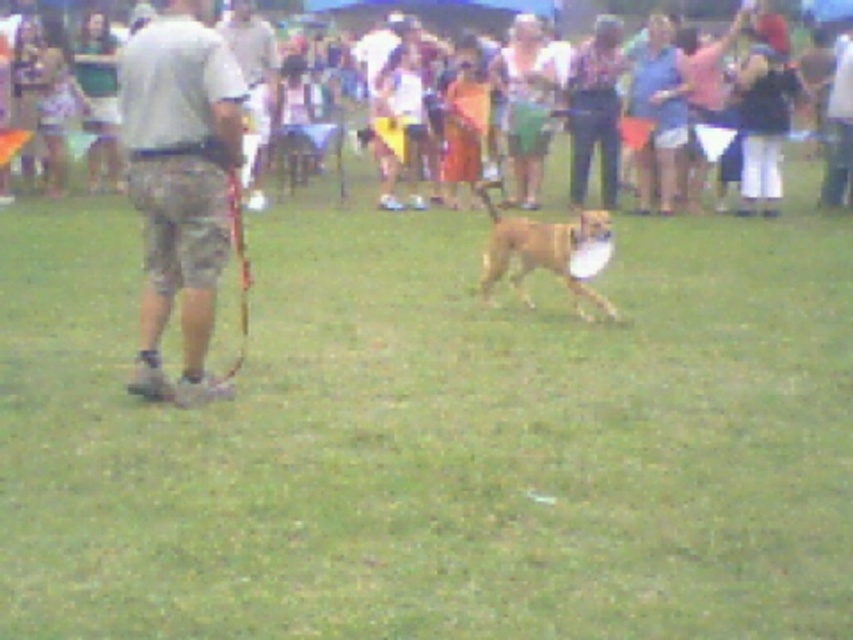
Question: Which object is the farthest from the camouflage shorts at left?

Choices:
 (A) matte brown dog at center
 (B) brown furry dog at center

Answer: (A)

Question: Based on their relative distances, which object is nearer to the camouflage shorts at left?

Choices:
 (A) brown furry dog at center
 (B) matte brown dog at center

Answer: (A)

Question: Can you confirm if camouflage shorts at left is positioned to the left of matte brown dog at center?

Choices:
 (A) no
 (B) yes

Answer: (B)

Question: Is camouflage shorts at left smaller than matte brown dog at center?

Choices:
 (A) yes
 (B) no

Answer: (A)

Question: Which point appears farthest from the camera in this image?

Choices:
 (A) (12, 8)
 (B) (234, 61)

Answer: (A)

Question: In this image, where is matte brown dog at center located relative to brown furry dog at center?

Choices:
 (A) above
 (B) below

Answer: (A)